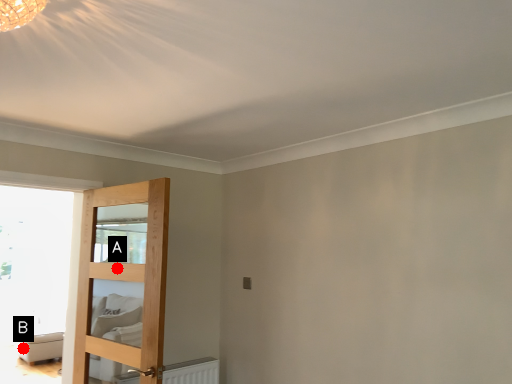
Question: Two points are circled on the image, labeled by A and B beside each circle. Which point appears farthest from the camera in this image?

Choices:
 (A) A is further
 (B) B is further

Answer: (B)